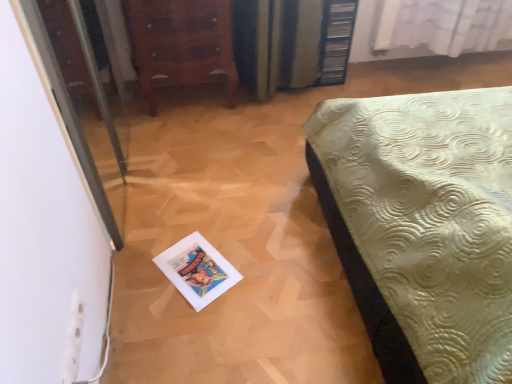
At what (x,y) coordinates should I click in order to perform the action: click on vacant region in front of transparent glass screen door at left. Please return your answer as a coordinate pair (x, y). This screenshot has height=384, width=512. Looking at the image, I should click on (168, 280).